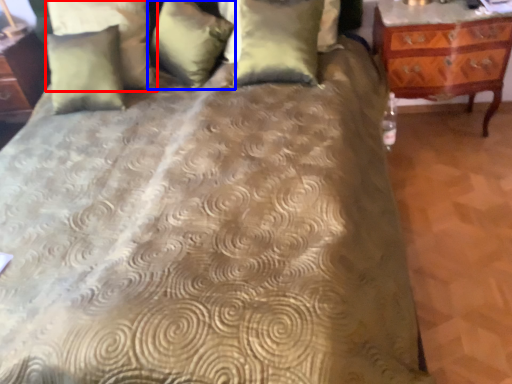
Question: Which object is further to the camera taking this photo, pillow (highlighted by a red box) or pillow (highlighted by a blue box)?

Choices:
 (A) pillow
 (B) pillow

Answer: (A)